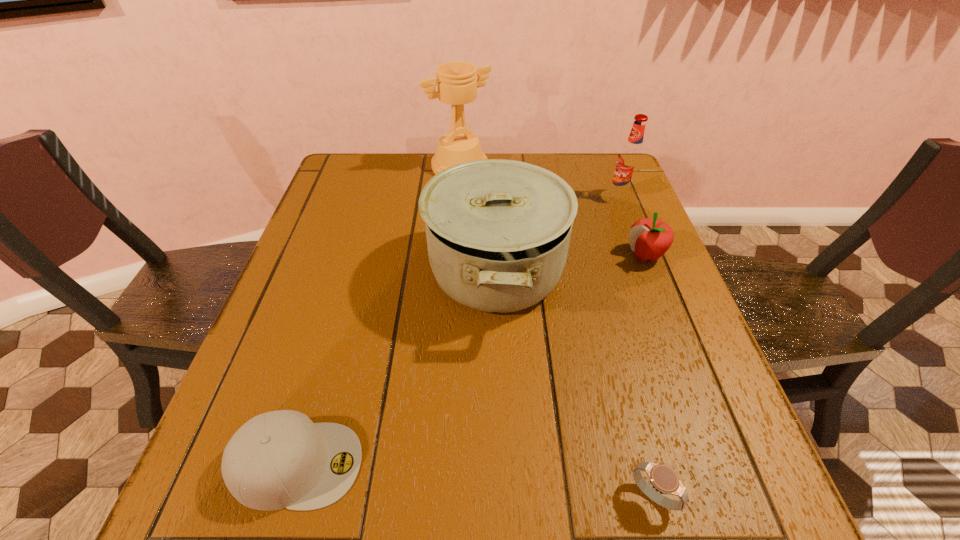
Locate an element on the screen. This screenshot has width=960, height=540. the farthest object is located at coordinates (457, 84).

The width and height of the screenshot is (960, 540). I want to click on the tallest object, so click(x=457, y=84).

Locate an element on the screen. The height and width of the screenshot is (540, 960). the second farthest object is located at coordinates (630, 159).

The height and width of the screenshot is (540, 960). In order to click on saucepan in this screenshot , I will do `click(498, 231)`.

Image resolution: width=960 pixels, height=540 pixels. Find the location of `the third shortest object`. the third shortest object is located at coordinates (650, 238).

Where is `the fifth tallest object`? the fifth tallest object is located at coordinates (280, 459).

Locate an element on the screen. This screenshot has width=960, height=540. the leftmost object is located at coordinates (280, 459).

Find the location of a particular element. the shortest object is located at coordinates (663, 478).

Identify the location of watch. Image resolution: width=960 pixels, height=540 pixels. (663, 478).

Locate an element on the screen. The image size is (960, 540). vacant point located on the front of the award is located at coordinates (453, 269).